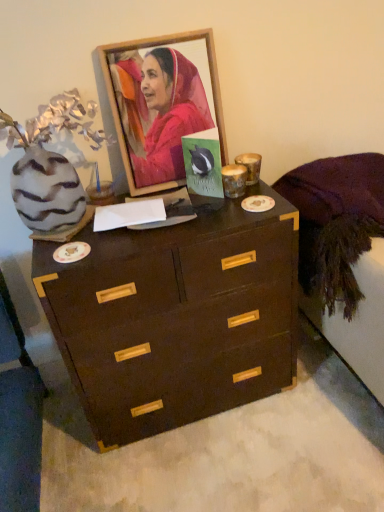
The height and width of the screenshot is (512, 384). Identify the location of free point above dark wood chest of drawers at center (from a real-world perspective). (167, 220).